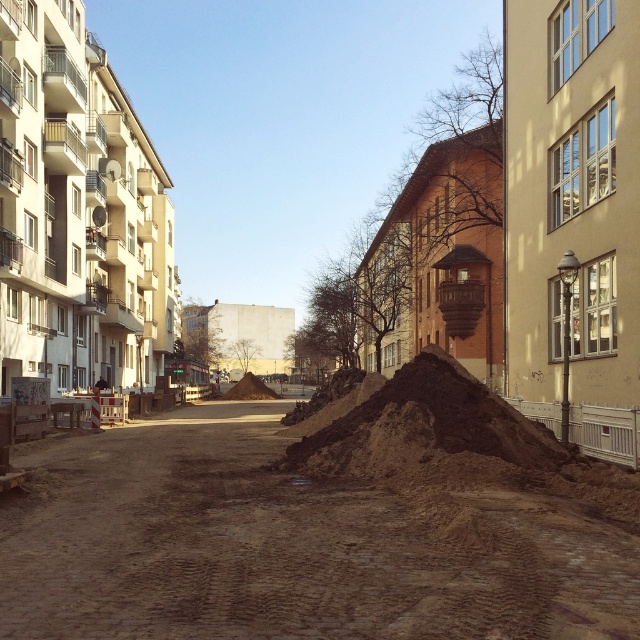
Which is more to the right, brown dirt track at center or brown earth mound at center?

brown earth mound at center

Who is more forward, [236,612] or [369,428]?

Point [236,612] is more forward.

Identify the location of brown dirt track at center. (291, 545).